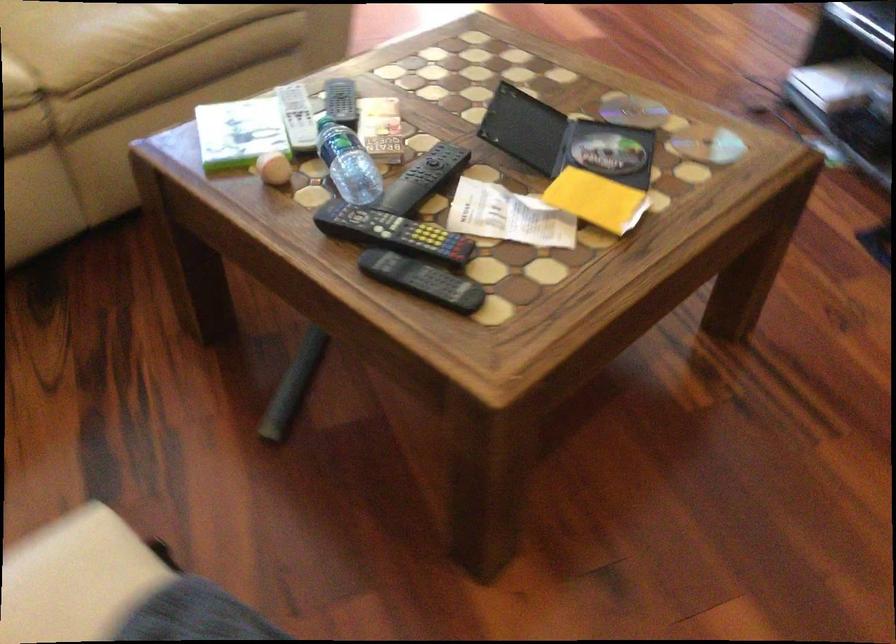
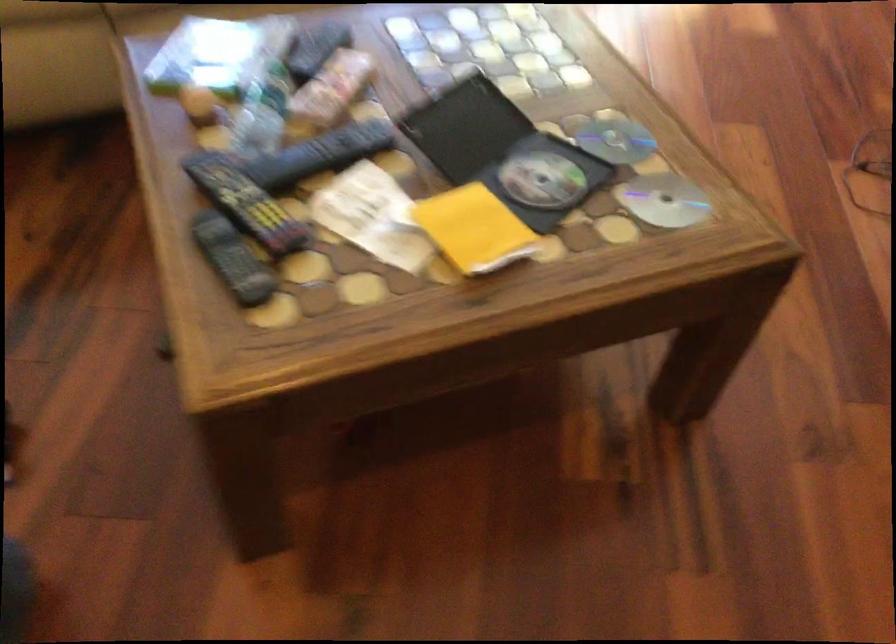
Question: Based on the continuous images, in which direction is the camera rotating? Reply with the corresponding letter.

Choices:
 (A) Left
 (B) Right
 (C) Up
 (D) Down

Answer: (A)